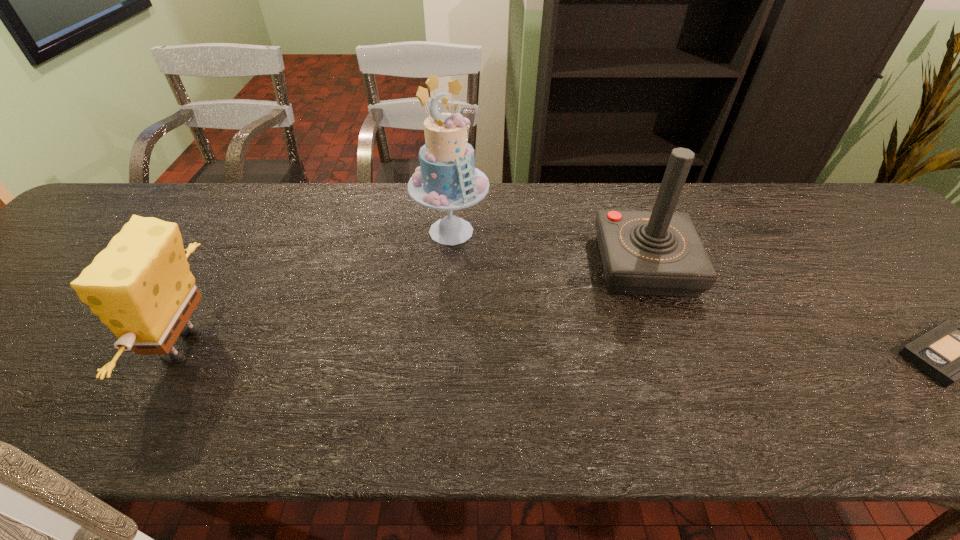
Locate an element on the screen. The width and height of the screenshot is (960, 540). vacant position located 0.230m on the rectangular base of the joystick is located at coordinates (682, 389).

Image resolution: width=960 pixels, height=540 pixels. In order to click on blank space located on the rectangular base of the joystick in this screenshot , I will do `click(660, 319)`.

Image resolution: width=960 pixels, height=540 pixels. I want to click on blank space located 0.120m on the rectangular base of the joystick, so click(667, 344).

The image size is (960, 540). I want to click on object present at the far edge, so click(447, 179).

What are the coordinates of `object present at the near edge` in the screenshot? It's located at (140, 286).

I want to click on vacant space at the far edge of the desktop, so click(x=243, y=193).

You are a GUI agent. You are given a task and a screenshot of the screen. Output one action in this format:
    pyautogui.click(x=<x>, y=<y>)
    Task: Click on the free space at the left edge of the desktop
    
    Given the screenshot: What is the action you would take?
    pyautogui.click(x=22, y=326)

I want to click on vacant space at the right edge of the desktop, so pos(897,259).

In the image, there is a desktop. Identify the location of vacant space at the far right corner. The height and width of the screenshot is (540, 960). (x=825, y=183).

Find the location of a particular element. This screenshot has width=960, height=540. vacant space that is in between the joystick and the second object from left to right is located at coordinates (547, 248).